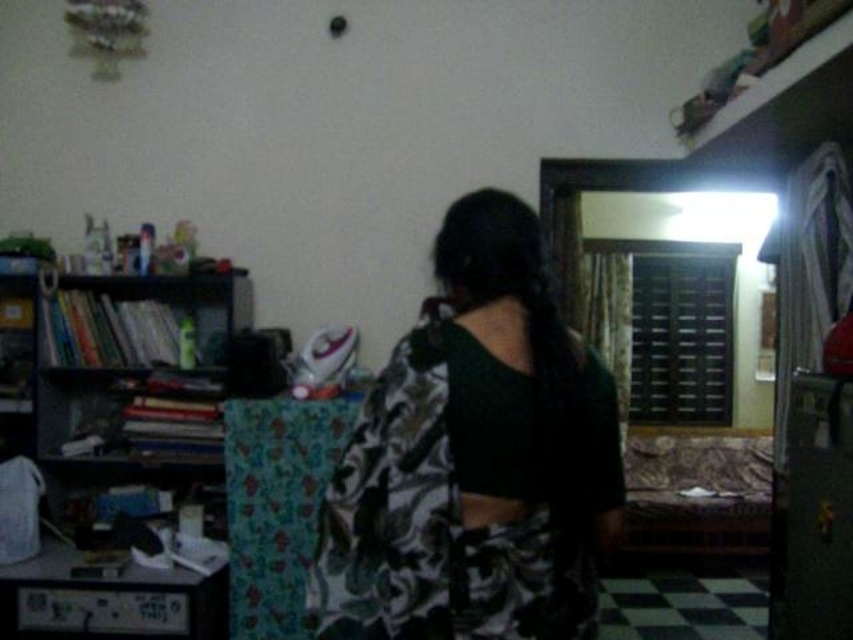
You are organizing a photoshoot in the room and need to ensure the printed fabric dress at center is visible without obstruction. Since the black matte bookshelf at left is in the background, will the dress be fully visible?

The printed fabric dress at center is in front of the black matte bookshelf at left, so yes, the dress will be fully visible without obstruction from the bookshelf.

You are organizing a photoshoot in this room and need to choose between placing a large prop next to the printed fabric dress at center or the black matte bookshelf at left. Based on their sizes, which object would allow the prop to fit better next to it?

The printed fabric dress at center has a smaller size compared to the black matte bookshelf at left, so placing the large prop next to the black matte bookshelf at left would allow more space and better fit.